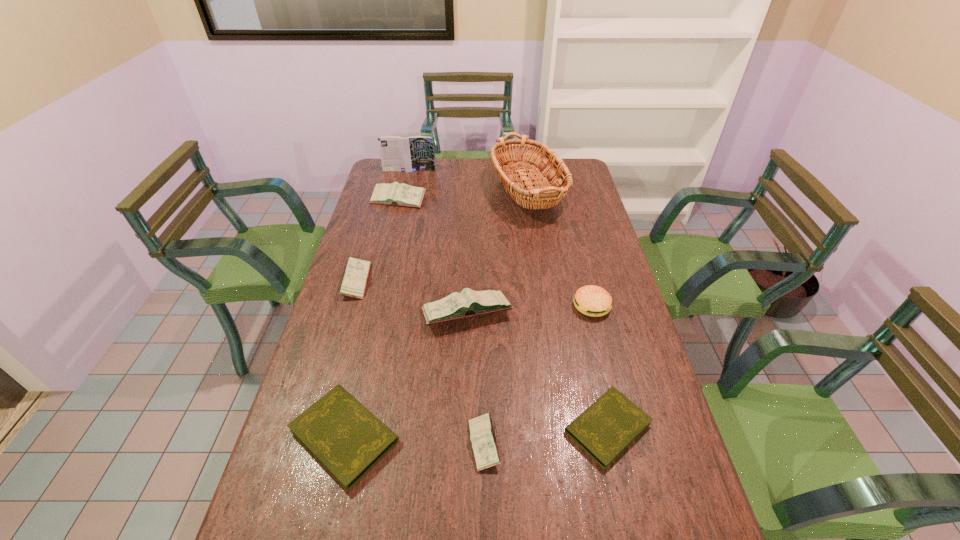
The width and height of the screenshot is (960, 540). Find the location of `blank area located on the back of the smallest pink diary`. blank area located on the back of the smallest pink diary is located at coordinates (484, 396).

This screenshot has height=540, width=960. I want to click on vacant space located 0.060m on the right of the bigger green diary, so click(x=425, y=436).

Find the location of a particular element. The height and width of the screenshot is (540, 960). free location located 0.230m on the left of the right green diary is located at coordinates [x=469, y=427].

Image resolution: width=960 pixels, height=540 pixels. Identify the location of basket that is at the far edge. (538, 194).

What are the coordinates of `book present at the far edge` in the screenshot? It's located at (415, 153).

The height and width of the screenshot is (540, 960). I want to click on book situated at the left edge, so click(x=415, y=153).

You are a GUI agent. You are given a task and a screenshot of the screen. Output one action in this format:
    pyautogui.click(x=<x>, y=<y>)
    Task: Click on the basket located in the right edge section of the desktop
    This screenshot has height=540, width=960.
    Given the screenshot: What is the action you would take?
    pyautogui.click(x=538, y=194)

Where is `patty that is positioned at the right edge`? This screenshot has width=960, height=540. patty that is positioned at the right edge is located at coordinates (590, 300).

In order to click on diary that is at the right edge in this screenshot , I will do [605, 429].

Find the location of a particular element. object positioned at the far left corner is located at coordinates (415, 153).